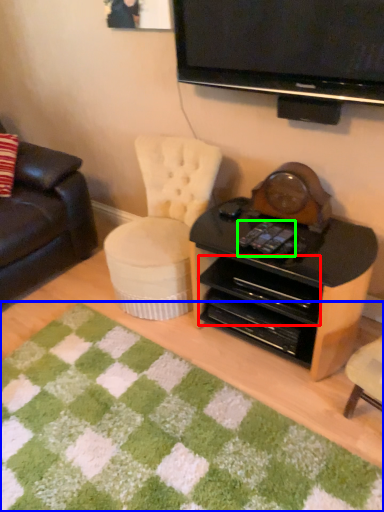
Question: Based on their relative distances, which object is farther from drawer (highlighted by a red box)? Choose from mat (highlighted by a blue box) and remote control (highlighted by a green box).

Choices:
 (A) mat
 (B) remote control

Answer: (A)